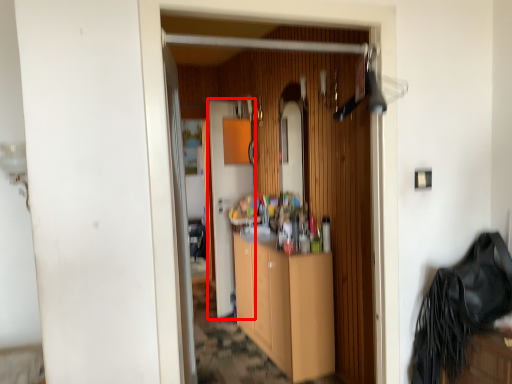
Question: Observing the image, what is the correct spatial positioning of door (annotated by the red box) in reference to cabinetry?

Choices:
 (A) right
 (B) left

Answer: (B)